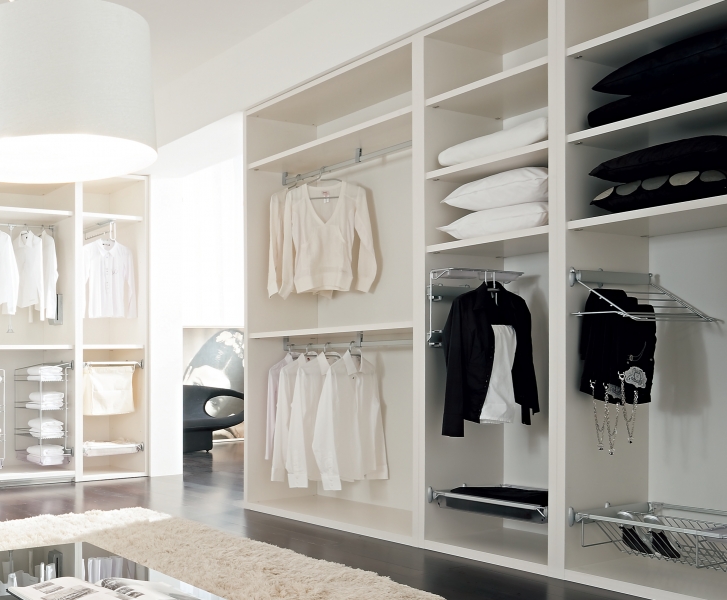
The image size is (727, 600). Identify the location of open hardback book. (73, 591).